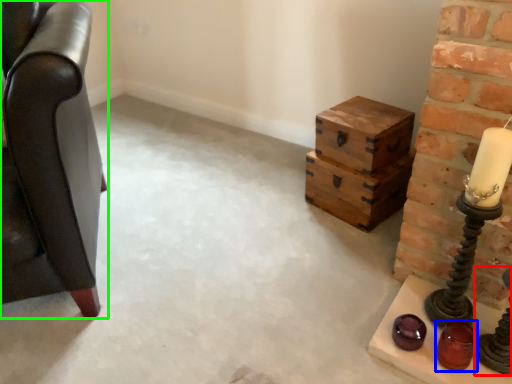
Question: Which object is the closest to the candle holder (highlighted by a red box)? Choose among these: candle holder (highlighted by a blue box) or furniture (highlighted by a green box).

Choices:
 (A) candle holder
 (B) furniture

Answer: (A)